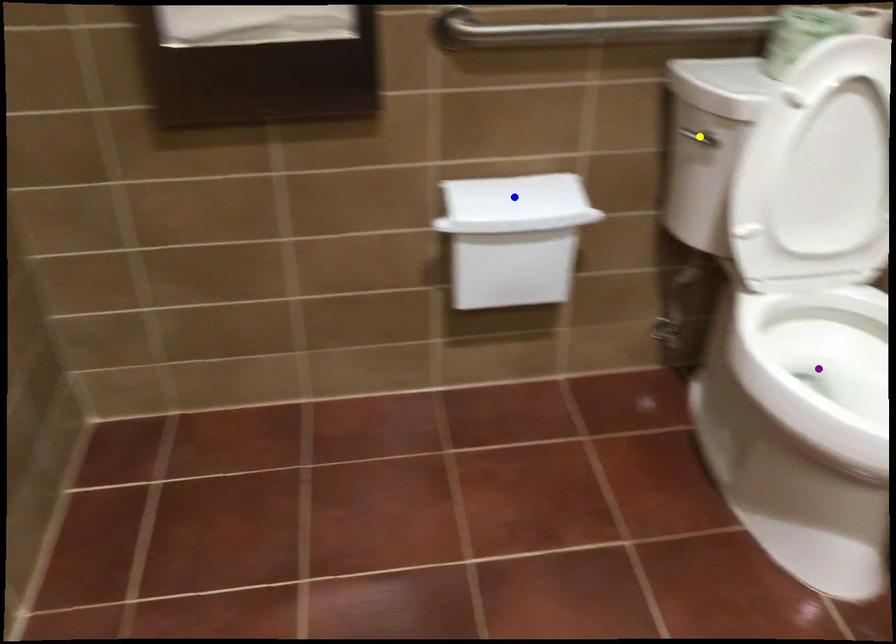
Order these from farthest to nearest:
purple point | yellow point | blue point

blue point, purple point, yellow point